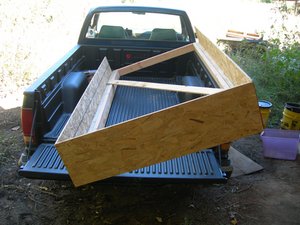
Where is `headrest`? The height and width of the screenshot is (225, 300). headrest is located at coordinates (110, 32), (164, 36).